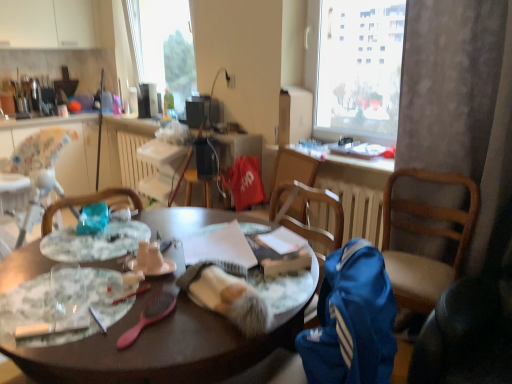
This screenshot has width=512, height=384. What are the coordinates of `white textured curtain at right` in the screenshot? It's located at (459, 99).

Locate an element on the screen. matte black lamp at upper center is located at coordinates (213, 90).

This screenshot has height=384, width=512. I want to click on blue fabric chair at right, so click(428, 235).

What is the approximate height of transparent glass window at upper center?

The height of transparent glass window at upper center is 1.07 meters.

In order to face wooden table at center, should I rotate leftwards or rightwards?

To align with it, rotate left about 11.567°.

Where is `wooden table at center`? wooden table at center is located at coordinates (158, 349).

What is the approximate height of matte white coffee cup at center?

3.84 inches.

What is the approximate height of translucent glass plate at center, the 1th plate in the back-to-front sequence?

It is 0.68 inches.

Find the location of `white textured curtain at right`. white textured curtain at right is located at coordinates (459, 99).

Considering the positions of objects transparent glass window at upper center and matte plastic power outlet at upper center in the image provided, who is in front, transparent glass window at upper center or matte plastic power outlet at upper center?

matte plastic power outlet at upper center is more forward.

Is transparent glass window at upper center inside the boundaries of matte plastic power outlet at upper center, or outside?

transparent glass window at upper center lies outside matte plastic power outlet at upper center.

From the image's perspective, between transparent glass window at upper center and matte plastic power outlet at upper center, who is located below?

From the image's view, matte plastic power outlet at upper center is below.

This screenshot has width=512, height=384. Identify the location of window screen above the matte plastic power outlet at upper center (from a real-world perspective). (164, 47).

Identify the location of lamp behind the marble-patterned plate at center-left, the first plate when ordered from front to back. This screenshot has width=512, height=384. (213, 90).

Can you confirm if matte black lamp at upper center is positioned to the right of marble-patterned plate at center-left, the first plate when ordered from front to back?

Indeed, matte black lamp at upper center is positioned on the right side of marble-patterned plate at center-left, the first plate when ordered from front to back.

Is matte black lamp at upper center wider than marble-patterned plate at center-left, the first plate when ordered from front to back?

No.

Is marble-patterned plate at center-left, the first plate when ordered from front to back, located within matte black lamp at upper center?

No, marble-patterned plate at center-left, the first plate when ordered from front to back, is not a part of matte black lamp at upper center.

How many degrees apart are the facing directions of matte plastic power outlet at upper center and translucent glass plate at center, the 1th plate in the back-to-front sequence?

92.4 degrees.

What are the coordinates of `power outlet that appears above the translucent glass plate at center, which is counted as the second plate, starting from the front (from a real-world perspective)` in the screenshot? It's located at (230, 80).

Does matte plastic power outlet at upper center contain translucent glass plate at center, which is counted as the second plate, starting from the front?

No, matte plastic power outlet at upper center does not contain translucent glass plate at center, which is counted as the second plate, starting from the front.

Is matte plastic power outlet at upper center facing away from translucent glass plate at center, which is counted as the second plate, starting from the front?

No.

How distant is translucent plastic bottle at upper center from blue fabric chair at right?

translucent plastic bottle at upper center and blue fabric chair at right are 2.16 meters apart from each other.

Looking at this image, is translucent plastic bottle at upper center with blue fabric chair at right?

No, translucent plastic bottle at upper center is not in contact with blue fabric chair at right.

From a real-world perspective, is translucent plastic bottle at upper center physically located above or below blue fabric chair at right?

Clearly, from a real-world perspective, translucent plastic bottle at upper center is above blue fabric chair at right.

How many degrees apart are the facing directions of matte plastic power outlet at upper center and transparent glass window at upper center?

A: There is a 1.42-degree angle between the facing directions of matte plastic power outlet at upper center and transparent glass window at upper center.

Is matte plastic power outlet at upper center beside transparent glass window at upper center?

No, matte plastic power outlet at upper center is not beside transparent glass window at upper center.

Between matte plastic power outlet at upper center and transparent glass window at upper center, which one is positioned behind?

transparent glass window at upper center is further away from the camera.

From the image's perspective, between matte plastic power outlet at upper center and transparent glass window at upper center, which one is located above?

From the image's view, transparent glass window at upper center is above.

Which of these two, matte plastic power outlet at upper center or white plastic radiator at center, is thinner?

matte plastic power outlet at upper center.

This screenshot has width=512, height=384. In order to click on power outlet on the right of white plastic radiator at center in this screenshot , I will do (x=230, y=80).

Is matte plastic power outlet at upper center touching white plastic radiator at center?

No, matte plastic power outlet at upper center is not touching white plastic radiator at center.

Which is farther, (228, 80) or (137, 155)?

The point (137, 155) is farther.

In order to click on power outlet in front of the white glossy countertop at upper left in this screenshot , I will do `click(230, 80)`.

Can you confirm if matte plastic power outlet at upper center is smaller than white glossy countertop at upper left?

Yes.

From the picture: From a real-world perspective, is matte plastic power outlet at upper center located higher than white glossy countertop at upper left?

Yes.

Could you tell me if matte plastic power outlet at upper center is facing white glossy countertop at upper left?

No, matte plastic power outlet at upper center is not turned towards white glossy countertop at upper left.

This screenshot has height=384, width=512. I want to click on window screen behind the matte plastic power outlet at upper center, so click(x=164, y=47).

Find the location of `lamp above the marble-patterned plate at center-left, which is the 2th plate in back-to-front order (from a real-world perspective)`. lamp above the marble-patterned plate at center-left, which is the 2th plate in back-to-front order (from a real-world perspective) is located at coordinates (213, 90).

Which object lies nearer to the anchor point white glossy countertop at upper left, white textured curtain at right or transparent glass window at upper center?

Based on the image, transparent glass window at upper center appears to be nearer to white glossy countertop at upper left.

From the image, which object appears to be farther from satin black speaker at center, transparent glass window at upper center or white glossy countertop at upper left?

Among the two, white glossy countertop at upper left is located further to satin black speaker at center.

From the image, which object appears to be nearer to translucent plastic bottle at upper center, white plastic radiator at center or white textured curtain at right?

white plastic radiator at center is positioned closer to the anchor translucent plastic bottle at upper center.

Which object lies nearer to the anchor point matte white coffee cup at center, blue fabric chair at right or translucent plastic bottle at upper center?

blue fabric chair at right is closer to matte white coffee cup at center.

Based on their spatial positions, is matte black lamp at upper center or wooden table at center closer to translucent glass plate at center, the 1th plate in the back-to-front sequence?

wooden table at center.

In the scene shown: Looking at the image, which one is located further to white glossy countertop at upper left, matte black lamp at upper center or translucent glass plate at center, the 1th plate in the back-to-front sequence?

translucent glass plate at center, the 1th plate in the back-to-front sequence, is further to white glossy countertop at upper left.

Considering their positions, is matte plastic power outlet at upper center positioned closer to translucent glass plate at center, which is counted as the second plate, starting from the front, than satin black speaker at center?

satin black speaker at center.

Looking at this image, when comparing their distances from matte black lamp at upper center, does white textured curtain at right or marble-patterned plate at center-left, the first plate when ordered from front to back, seem closer?

white textured curtain at right is closer to matte black lamp at upper center.

The image size is (512, 384). What are the coordinates of `plate between matte white coffee cup at center and white plastic radiator at center along the z-axis` in the screenshot? It's located at (95, 242).

You are a GUI agent. You are given a task and a screenshot of the screen. Output one action in this format:
    pyautogui.click(x=<x>, y=<y>)
    Task: Click on the radiator between marble-patterned plate at center-left, which is the 2th plate in back-to-front order, and translucent plastic bottle at upper center in the front-back direction
    The image size is (512, 384).
    Given the screenshot: What is the action you would take?
    pos(158,170)

Locate an element on the screen. The width and height of the screenshot is (512, 384). radiator between wooden table at center and white glossy countertop at upper left in the front-back direction is located at coordinates (158, 170).

Locate an element on the screen. radiator located between matte white coffee cup at center and matte black lamp at upper center in the depth direction is located at coordinates (158, 170).